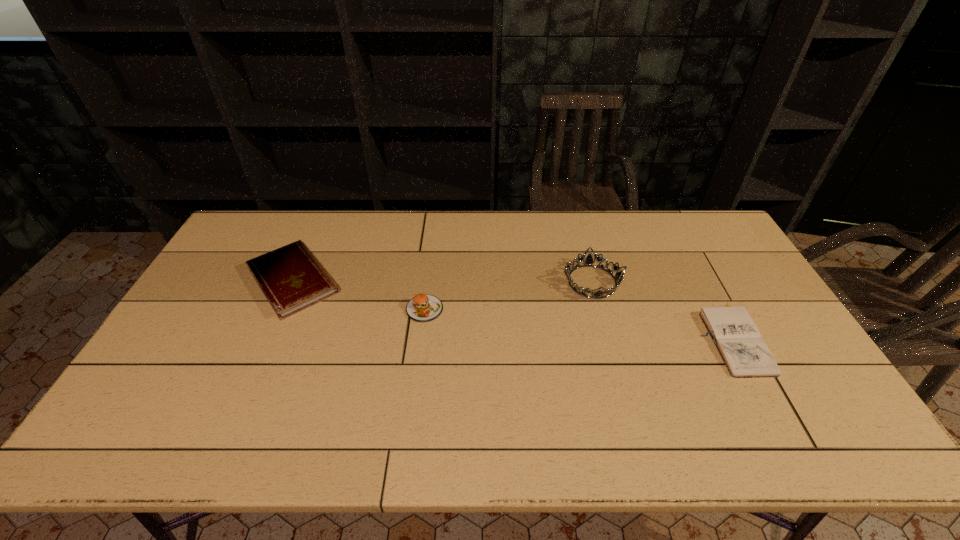
Locate an element on the screen. The image size is (960, 540). tiara is located at coordinates (588, 262).

You are a GUI agent. You are given a task and a screenshot of the screen. Output one action in this format:
    pyautogui.click(x=<x>, y=<y>)
    Task: Click on the tallest object
    
    Given the screenshot: What is the action you would take?
    pyautogui.click(x=588, y=262)

At what (x,y) coordinates should I click in order to perform the action: click on patty. Please return your answer as a coordinate pair (x, y). The image size is (960, 540). Looking at the image, I should click on (422, 308).

Find the location of a particular element. The height and width of the screenshot is (540, 960). the second tallest object is located at coordinates (422, 308).

At what (x,y) coordinates should I click in order to perform the action: click on the left notebook. Please return your answer as a coordinate pair (x, y). Looking at the image, I should click on (290, 277).

This screenshot has width=960, height=540. I want to click on the right notebook, so click(746, 355).

Where is `vacant space positioned on the front-facing side of the tiara`? The width and height of the screenshot is (960, 540). vacant space positioned on the front-facing side of the tiara is located at coordinates (607, 335).

Identify the location of free space located on the right of the patty. pos(493,309).

Where is `vacant space positioned 0.130m on the right of the left notebook`? The height and width of the screenshot is (540, 960). vacant space positioned 0.130m on the right of the left notebook is located at coordinates (386, 280).

Where is `vacant space located on the left of the right notebook`? The height and width of the screenshot is (540, 960). vacant space located on the left of the right notebook is located at coordinates (619, 338).